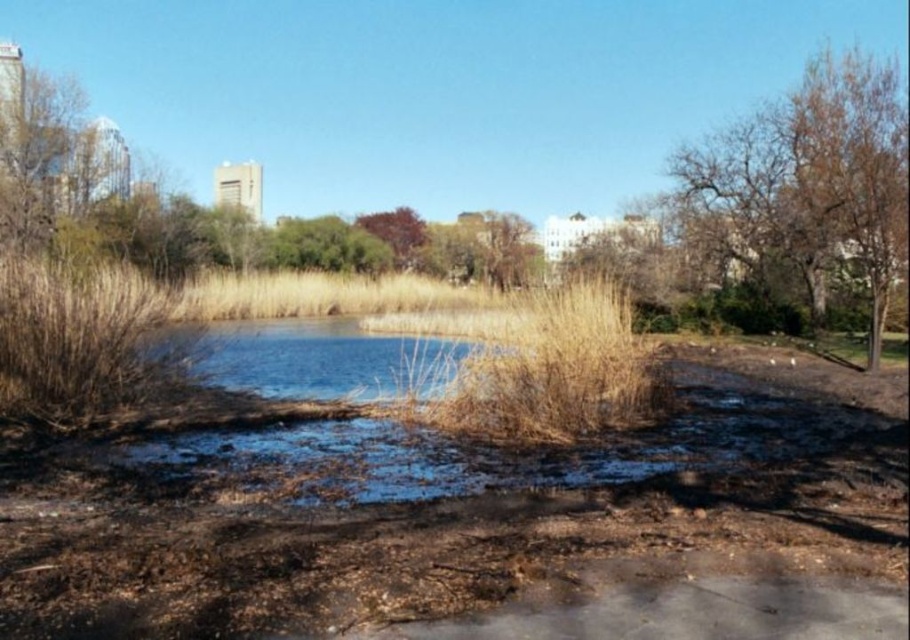
Question: From the image, what is the correct spatial relationship of dry grass at center in relation to blue water at center?

Choices:
 (A) left
 (B) right

Answer: (B)

Question: Considering the relative positions of dry grass at center and purple leafy tree at center in the image provided, where is dry grass at center located with respect to purple leafy tree at center?

Choices:
 (A) above
 (B) below

Answer: (B)

Question: Is brown/dry bark tree at right to the left of purple leafy tree at center from the viewer's perspective?

Choices:
 (A) yes
 (B) no

Answer: (B)

Question: Which point is farther to the camera?

Choices:
 (A) (395, 340)
 (B) (760, 236)
 (C) (378, 236)
 (D) (489, 426)

Answer: (C)

Question: Estimate the real-world distances between objects in this image. Which object is farther from the purple leafy tree at center?

Choices:
 (A) blue water at center
 (B) dry grass at center

Answer: (B)

Question: Which of the following is the closest to the observer?

Choices:
 (A) (531, 397)
 (B) (779, 102)

Answer: (A)